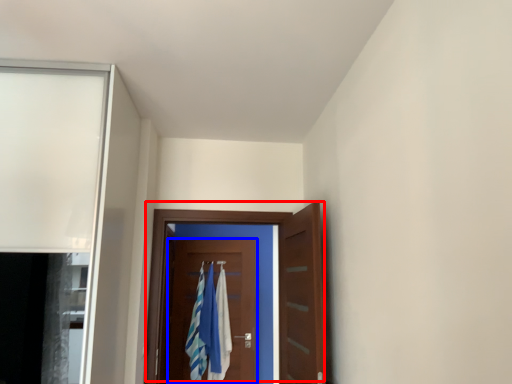
Question: Which point is closer to the camera, door (highlighted by a red box) or door (highlighted by a blue box)?

Choices:
 (A) door
 (B) door

Answer: (A)